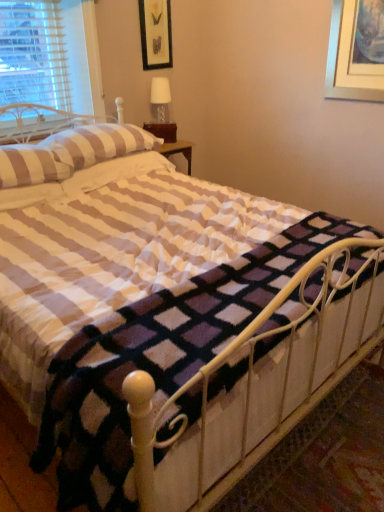
Question: Is there a large distance between striped fabric pillow at upper left, the 3th pillow in the back-to-front sequence, and striped fabric pillow at upper left, the 2th pillow viewed from the back?

Choices:
 (A) yes
 (B) no

Answer: (B)

Question: Is striped fabric pillow at upper left, the 3th pillow in the back-to-front sequence, positioned beyond the bounds of striped fabric pillow at upper left, marked as the 2th pillow in a front-to-back arrangement?

Choices:
 (A) no
 (B) yes

Answer: (B)

Question: Does striped fabric pillow at upper left, the 3th pillow in the back-to-front sequence, have a smaller size compared to striped fabric pillow at upper left, the 2th pillow viewed from the back?

Choices:
 (A) yes
 (B) no

Answer: (A)

Question: Does striped fabric pillow at upper left, the 3th pillow in the back-to-front sequence, have a greater width compared to striped fabric pillow at upper left, the 2th pillow viewed from the back?

Choices:
 (A) yes
 (B) no

Answer: (A)

Question: Is striped fabric pillow at upper left, the 3th pillow in the back-to-front sequence, to the left of striped fabric pillow at upper left, the 2th pillow viewed from the back, from the viewer's perspective?

Choices:
 (A) yes
 (B) no

Answer: (A)

Question: Would you say striped fabric pillow at upper left, the 2th pillow viewed from the back, is part of striped fabric pillow at upper left, the 3th pillow in the back-to-front sequence,'s contents?

Choices:
 (A) no
 (B) yes

Answer: (A)

Question: Considering the relative positions of white metal bed frame at center and black matte picture frame at upper center in the image provided, is white metal bed frame at center to the right of black matte picture frame at upper center from the viewer's perspective?

Choices:
 (A) yes
 (B) no

Answer: (A)

Question: Is white metal bed frame at center thinner than black matte picture frame at upper center?

Choices:
 (A) no
 (B) yes

Answer: (A)

Question: Is white metal bed frame at center far away from black matte picture frame at upper center?

Choices:
 (A) yes
 (B) no

Answer: (A)

Question: Does white metal bed frame at center lie behind black matte picture frame at upper center?

Choices:
 (A) yes
 (B) no

Answer: (B)

Question: Is the depth of white metal bed frame at center less than that of black matte picture frame at upper center?

Choices:
 (A) yes
 (B) no

Answer: (A)

Question: From the image's perspective, is white metal bed frame at center located above black matte picture frame at upper center?

Choices:
 (A) no
 (B) yes

Answer: (A)

Question: Is striped fabric pillow at upper left, the 3th pillow in the back-to-front sequence, facing towards black matte picture frame at upper center?

Choices:
 (A) no
 (B) yes

Answer: (A)